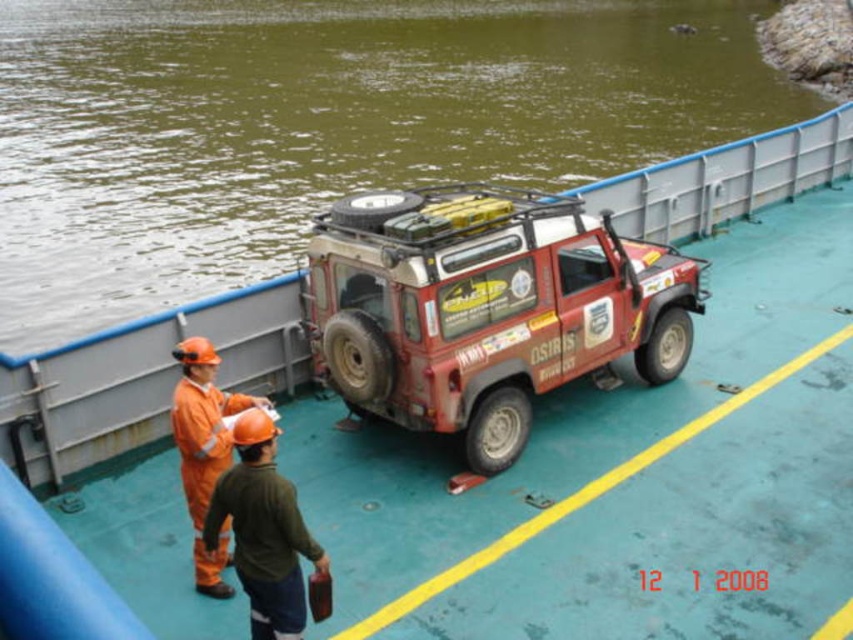
Question: Is green water at upper left positioned behind orange hard hat at left?

Choices:
 (A) no
 (B) yes

Answer: (B)

Question: Which object is the farthest from the green water at upper left?

Choices:
 (A) orange hard hat at center
 (B) orange hard hat at left

Answer: (B)

Question: Which of the following is the farthest from the observer?

Choices:
 (A) orange hard hat at left
 (B) orange hard hat at center
 (C) green water at upper left

Answer: (C)

Question: Observing the image, what is the correct spatial positioning of green water at upper left in reference to orange hard hat at center?

Choices:
 (A) above
 (B) below

Answer: (A)

Question: Can you confirm if orange hard hat at center is thinner than orange hard hat at left?

Choices:
 (A) no
 (B) yes

Answer: (A)

Question: Which of the following is the closest to the observer?

Choices:
 (A) rusty metal jeep at center
 (B) orange hard hat at center

Answer: (B)